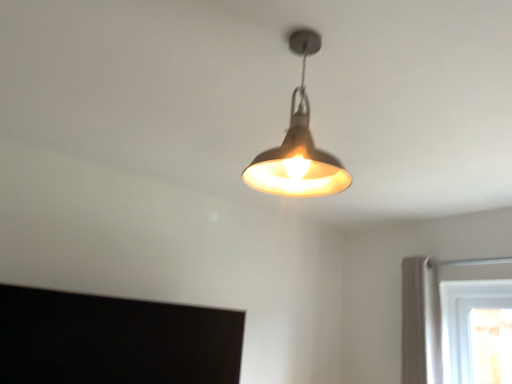
Describe the element at coordinates (298, 145) in the screenshot. This screenshot has height=384, width=512. I see `matte silver lampshade at center` at that location.

Where is `matte silver lampshade at center`? The width and height of the screenshot is (512, 384). matte silver lampshade at center is located at coordinates (298, 145).

What do you see at coordinates (421, 322) in the screenshot?
I see `white fabric curtain at right` at bounding box center [421, 322].

Find the location of a particular element. white fabric curtain at right is located at coordinates (421, 322).

In order to click on matte silver lampshade at center in this screenshot , I will do [298, 145].

Does matte silver lampshade at center appear on the right side of white fabric curtain at right?

In fact, matte silver lampshade at center is to the left of white fabric curtain at right.

Is matte silver lampshade at center in front of or behind white fabric curtain at right in the image?

Clearly, matte silver lampshade at center is in front of white fabric curtain at right.

Considering the points (302, 180) and (413, 312), which point is behind, point (302, 180) or point (413, 312)?

The point (413, 312) is more distant.

From the image's perspective, is matte silver lampshade at center under white fabric curtain at right?

No, from the image's perspective, matte silver lampshade at center is not beneath white fabric curtain at right.

From a real-world perspective, is matte silver lampshade at center over white fabric curtain at right?

Yes.

Which of these two, matte silver lampshade at center or white fabric curtain at right, is thinner?

white fabric curtain at right.

Considering the sizes of objects matte silver lampshade at center and white fabric curtain at right in the image provided, who is taller, matte silver lampshade at center or white fabric curtain at right?

Standing taller between the two is white fabric curtain at right.

Who is smaller, matte silver lampshade at center or white fabric curtain at right?

With smaller size is matte silver lampshade at center.

Do you think matte silver lampshade at center is within white fabric curtain at right, or outside of it?

matte silver lampshade at center is outside white fabric curtain at right.

Is matte silver lampshade at center with white fabric curtain at right?

No, matte silver lampshade at center is not making contact with white fabric curtain at right.

Could you tell me if matte silver lampshade at center is turned towards white fabric curtain at right?

No, matte silver lampshade at center is not facing towards white fabric curtain at right.

How much distance is there between matte silver lampshade at center and white fabric curtain at right?

A distance of 6.47 feet exists between matte silver lampshade at center and white fabric curtain at right.

You are a GUI agent. You are given a task and a screenshot of the screen. Output one action in this format:
    pyautogui.click(x=<x>, y=<y>)
    Task: Click on the curtain below the matte silver lampshade at center (from the image's perspective)
    
    Given the screenshot: What is the action you would take?
    pyautogui.click(x=421, y=322)

Considering the relative positions of white fabric curtain at right and matte silver lampshade at center in the image provided, is white fabric curtain at right to the left of matte silver lampshade at center from the viewer's perspective?

In fact, white fabric curtain at right is to the right of matte silver lampshade at center.

Is white fabric curtain at right in front of or behind matte silver lampshade at center in the image?

Clearly, white fabric curtain at right is behind matte silver lampshade at center.

Which point is more forward, (440, 374) or (306, 154)?

The point (306, 154) is more forward.

From the image's perspective, does white fabric curtain at right appear lower than matte silver lampshade at center?

Indeed, from the image's perspective, white fabric curtain at right is shown beneath matte silver lampshade at center.

From a real-world perspective, is white fabric curtain at right on top of matte silver lampshade at center?

Actually, white fabric curtain at right is physically below matte silver lampshade at center in the real world.

Between white fabric curtain at right and matte silver lampshade at center, which one has larger width?

matte silver lampshade at center is wider.

Considering the sizes of white fabric curtain at right and matte silver lampshade at center in the image, is white fabric curtain at right taller or shorter than matte silver lampshade at center?

Considering their sizes, white fabric curtain at right has more height than matte silver lampshade at center.

Does white fabric curtain at right have a larger size compared to matte silver lampshade at center?

Correct, white fabric curtain at right is larger in size than matte silver lampshade at center.

Choose the correct answer: Is white fabric curtain at right inside matte silver lampshade at center or outside it?

white fabric curtain at right is located beyond the bounds of matte silver lampshade at center.

Looking at this image, is white fabric curtain at right next to matte silver lampshade at center and touching it?

No, white fabric curtain at right is not touching matte silver lampshade at center.

Is white fabric curtain at right turned away from matte silver lampshade at center?

No, white fabric curtain at right is not facing the opposite direction of matte silver lampshade at center.

Find the location of a particular element. Image resolution: width=512 pixels, height=384 pixels. curtain below the matte silver lampshade at center (from a real-world perspective) is located at coordinates (421, 322).

Where is `lamp in front of the white fabric curtain at right`? The width and height of the screenshot is (512, 384). lamp in front of the white fabric curtain at right is located at coordinates (298, 145).

Identify the location of curtain below the matte silver lampshade at center (from the image's perspective). The image size is (512, 384). (421, 322).